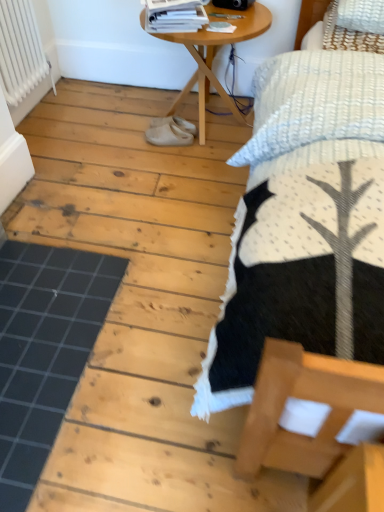
I want to click on free space above black rubber mat at lower left (from a real-world perspective), so click(42, 324).